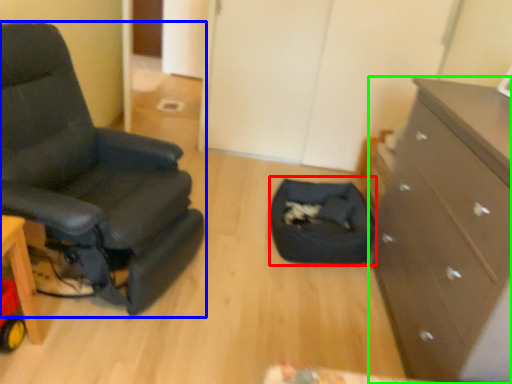
Question: Which object is the closest to the footrest (highlighted by a red box)? Choose among these: chair (highlighted by a blue box) or chest of drawers (highlighted by a green box).

Choices:
 (A) chair
 (B) chest of drawers

Answer: (B)